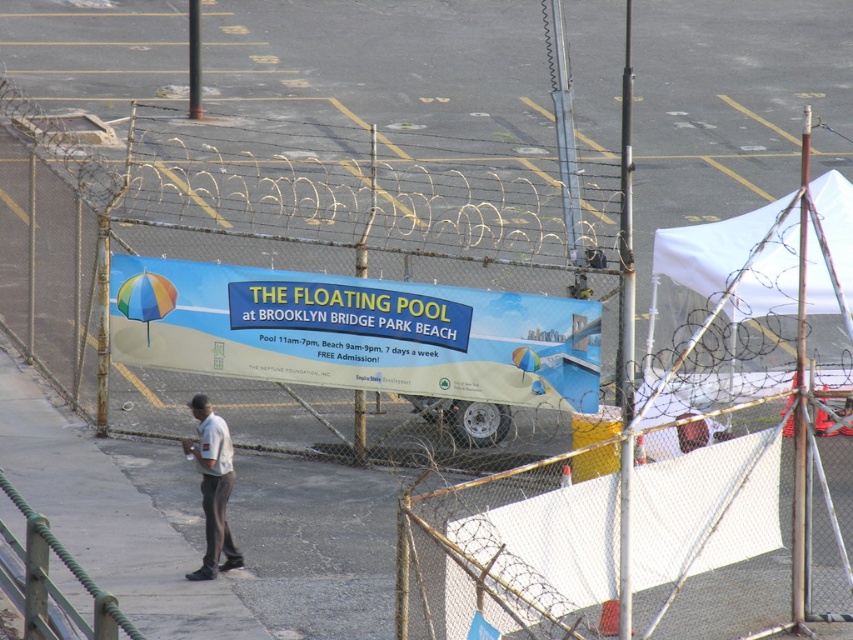
Between white fabric canopy at upper right and white cotton shirt at center, which one has less height?

white cotton shirt at center is shorter.

Can you confirm if white fabric canopy at upper right is wider than white cotton shirt at center?

Yes.

Between point (717, 232) and point (199, 438), which one is positioned behind?

The point (717, 232) is behind.

Image resolution: width=853 pixels, height=640 pixels. Identify the location of white fabric canopy at upper right. (732, 262).

Who is more distant from viewer, (242, 333) or (834, 246)?

The point (834, 246) is more distant.

You are a GUI agent. You are given a task and a screenshot of the screen. Output one action in this format:
    pyautogui.click(x=<x>, y=<y>)
    Task: Click on the blue glossy sign at center
    
    Given the screenshot: What is the action you would take?
    pyautogui.click(x=355, y=332)

At what (x,y) coordinates should I click in order to perform the action: click on blue glossy sign at center. Please return your answer as a coordinate pair (x, y). Looking at the image, I should click on (355, 332).

Measure the distance from rusty chain-link fence at center to blue glossy sign at center.

6.45 feet

Does rusty chain-link fence at center appear on the right side of blue glossy sign at center?

Incorrect, rusty chain-link fence at center is not on the right side of blue glossy sign at center.

Locate an element on the screen. This screenshot has width=853, height=640. rusty chain-link fence at center is located at coordinates (364, 305).